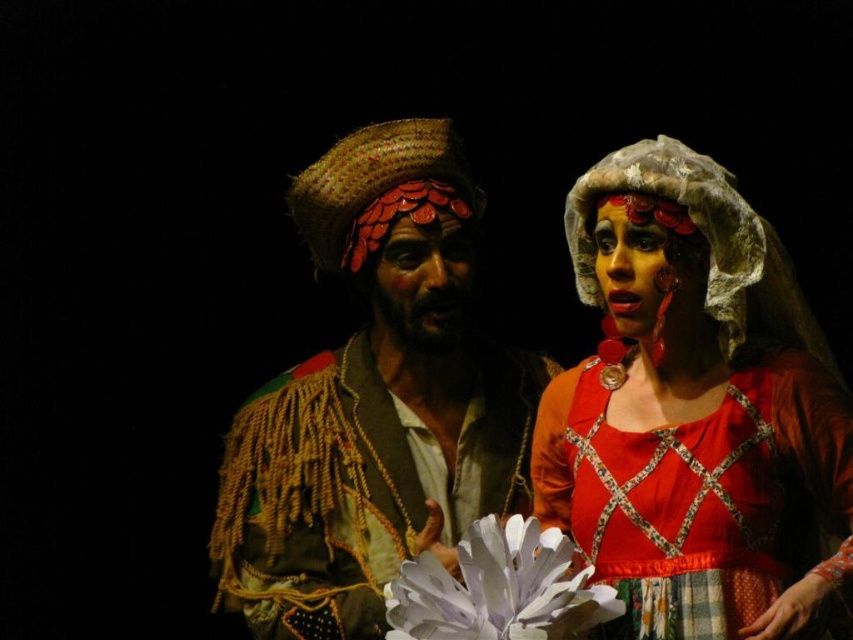
Does point (448, 492) come closer to viewer compared to point (398, 268)?

No, (448, 492) is further to viewer.

Can you confirm if textured straw hat at center is positioned to the right of matte red scales at center?

Incorrect, textured straw hat at center is not on the right side of matte red scales at center.

Identify the location of textured straw hat at center. (374, 401).

Consider the image. Is matte red dress at center thinner than textured straw hat at center?

Yes.

Which of these two, matte red dress at center or textured straw hat at center, stands shorter?

matte red dress at center

Between point (587, 380) and point (341, 177), which one is positioned in front?

Positioned in front is point (587, 380).

You are a GUI agent. You are given a task and a screenshot of the screen. Output one action in this format:
    pyautogui.click(x=<x>, y=<y>)
    Task: Click on the matte red dress at center
    Image resolution: width=853 pixels, height=640 pixels.
    Given the screenshot: What is the action you would take?
    pyautogui.click(x=689, y=401)

Is point (612, 310) positioned in front of point (457, 234)?

That is True.

Does matte red dress at center appear on the right side of matte red scales at center?

Correct, you'll find matte red dress at center to the right of matte red scales at center.

Which is behind, point (537, 426) or point (380, 280)?

Point (380, 280)

I want to click on matte red dress at center, so (x=689, y=401).